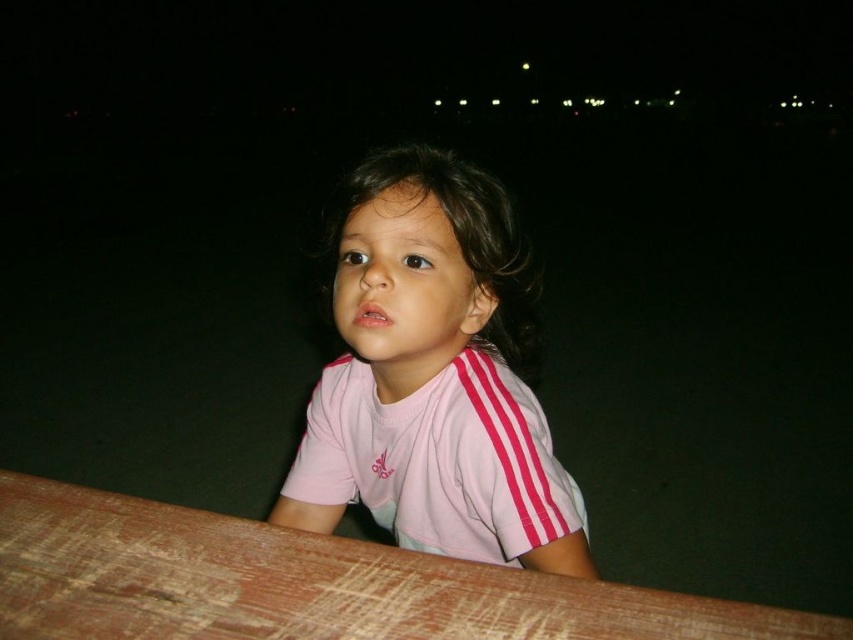
Between pink fabric shirt at center and brown wooden table at lower center, which one is positioned lower?

Positioned lower is brown wooden table at lower center.

Is point (372, 220) farther from camera compared to point (614, 625)?

Yes.

Is point (517, 292) positioned before point (178, 636)?

No, it is not.

This screenshot has width=853, height=640. Find the location of `pink fabric shirt at center`. pink fabric shirt at center is located at coordinates (433, 376).